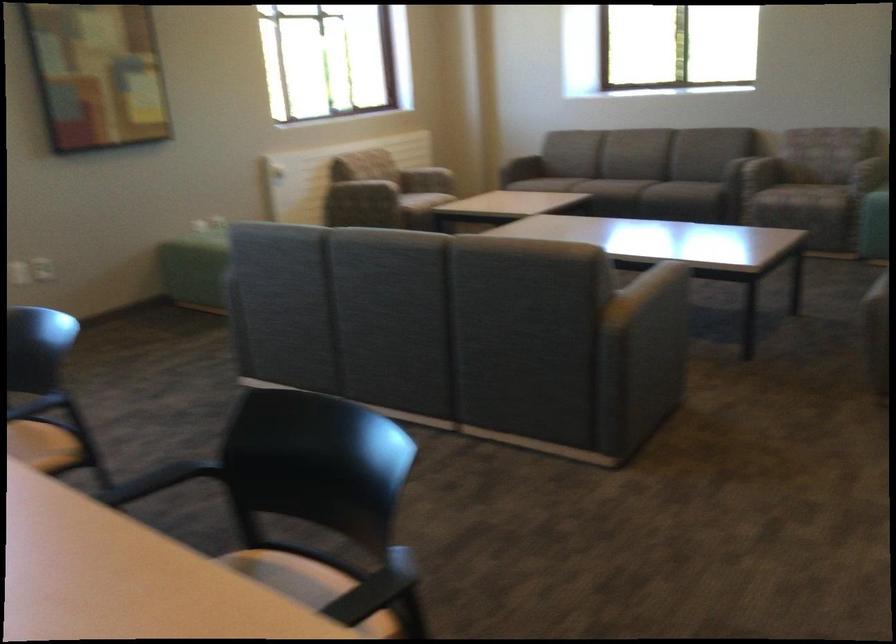
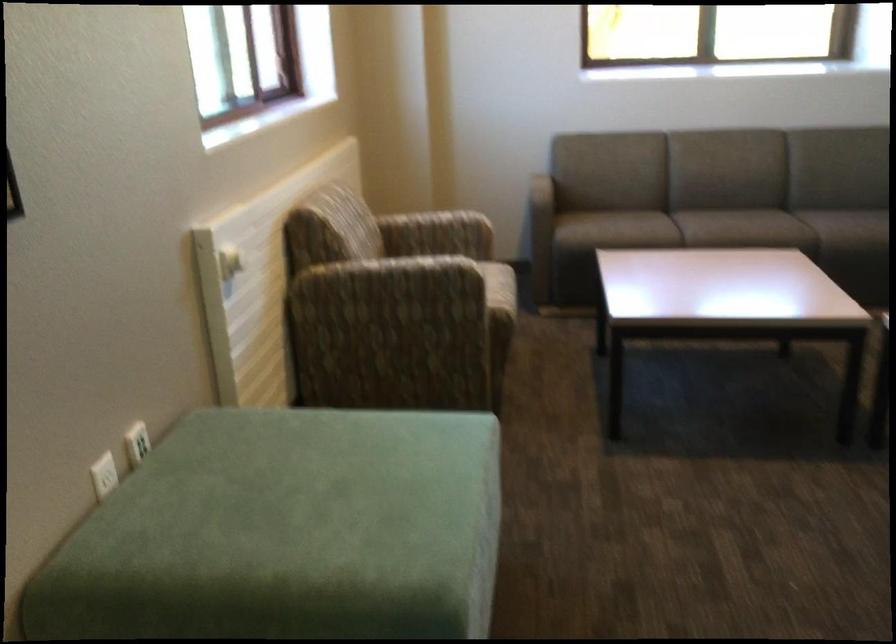
In the second image, find the point that corresponds to the point at 492,176 in the first image.

(540, 234)